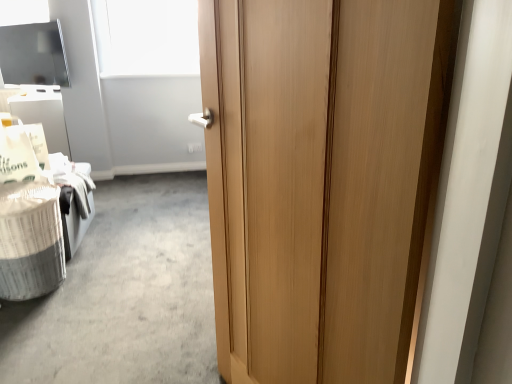
Image resolution: width=512 pixels, height=384 pixels. What do you see at coordinates (321, 179) in the screenshot?
I see `wooden door at center` at bounding box center [321, 179].

Image resolution: width=512 pixels, height=384 pixels. In order to click on wooden door at center in this screenshot , I will do `click(321, 179)`.

Measure the distance between white textured laundry basket at lower left and camera.

white textured laundry basket at lower left and camera are 2.03 meters apart from each other.

Where is `white matte window screen at upper center`? white matte window screen at upper center is located at coordinates (146, 37).

Where is `laundry basket below the wooden door at center (from the image's perspective)`? The width and height of the screenshot is (512, 384). laundry basket below the wooden door at center (from the image's perspective) is located at coordinates (30, 241).

Considering the sizes of objects wooden door at center and white textured laundry basket at lower left in the image provided, who is shorter, wooden door at center or white textured laundry basket at lower left?

Standing shorter between the two is white textured laundry basket at lower left.

Considering the positions of point (431, 81) and point (41, 220), is point (431, 81) closer or farther from the camera than point (41, 220)?

Point (431, 81) is positioned closer to the camera compared to point (41, 220).

Do you think wooden door at center is within white textured laundry basket at lower left, or outside of it?

wooden door at center exists outside the volume of white textured laundry basket at lower left.

Considering the sizes of wooden door at center and white matte window screen at upper center in the image, is wooden door at center taller or shorter than white matte window screen at upper center?

wooden door at center is taller than white matte window screen at upper center.

Looking at this image, considering their positions, is wooden door at center located in front of or behind white matte window screen at upper center?

wooden door at center is positioned closer to the viewer than white matte window screen at upper center.

Considering the sizes of objects wooden door at center and white matte window screen at upper center in the image provided, who is thinner, wooden door at center or white matte window screen at upper center?

wooden door at center.

Considering the points (319, 361) and (151, 69), which point is in front, point (319, 361) or point (151, 69)?

The point (319, 361) is more forward.

How different are the orientations of white textured laundry basket at lower left and white matte window screen at upper center in degrees?

The angular difference between white textured laundry basket at lower left and white matte window screen at upper center is 89.7 degrees.

Considering the positions of point (1, 199) and point (197, 27), is point (1, 199) closer or farther from the camera than point (197, 27)?

Point (1, 199) is farther from the camera than point (197, 27).

Do you think white textured laundry basket at lower left is within white matte window screen at upper center, or outside of it?

white textured laundry basket at lower left is located beyond the bounds of white matte window screen at upper center.

Considering the sizes of white textured laundry basket at lower left and wooden door at center in the image, is white textured laundry basket at lower left wider or thinner than wooden door at center?

Clearly, white textured laundry basket at lower left has more width compared to wooden door at center.

From a real-world perspective, is white textured laundry basket at lower left on wooden door at center?

No, from a real-world perspective, white textured laundry basket at lower left is not above wooden door at center.

Is white textured laundry basket at lower left positioned with its back to wooden door at center?

white textured laundry basket at lower left is not turned away from wooden door at center.

Looking at the image, does white matte window screen at upper center seem bigger or smaller compared to wooden door at center?

Considering their sizes, white matte window screen at upper center takes up less space than wooden door at center.

Could you tell me if white matte window screen at upper center is facing wooden door at center?

Yes, white matte window screen at upper center is oriented towards wooden door at center.

Who is taller, white matte window screen at upper center or wooden door at center?

wooden door at center.

I want to click on laundry basket in front of the white matte window screen at upper center, so click(30, 241).

Is white matte window screen at upper center oriented towards white textured laundry basket at lower left?

Yes, white matte window screen at upper center is oriented towards white textured laundry basket at lower left.

Looking at their sizes, would you say white matte window screen at upper center is wider or thinner than white textured laundry basket at lower left?

In the image, white matte window screen at upper center appears to be more narrow than white textured laundry basket at lower left.

Does white matte window screen at upper center have a lesser height compared to white textured laundry basket at lower left?

Incorrect, the height of white matte window screen at upper center does not fall short of that of white textured laundry basket at lower left.

This screenshot has width=512, height=384. I want to click on door on the right of white textured laundry basket at lower left, so click(321, 179).

At what (x,y) coordinates should I click in order to perform the action: click on door located below the white matte window screen at upper center (from the image's perspective). Please return your answer as a coordinate pair (x, y). The image size is (512, 384). Looking at the image, I should click on (321, 179).

From the image, which object appears to be nearer to white textured laundry basket at lower left, white matte window screen at upper center or wooden door at center?

wooden door at center lies closer to white textured laundry basket at lower left than the other object.

From the image, which object appears to be nearer to wooden door at center, white textured laundry basket at lower left or white matte window screen at upper center?

white textured laundry basket at lower left is positioned closer to the anchor wooden door at center.

Which object lies nearer to the anchor point wooden door at center, white matte window screen at upper center or white textured laundry basket at lower left?

white textured laundry basket at lower left.

Estimate the real-world distances between objects in this image. Which object is closer to white textured laundry basket at lower left, wooden door at center or white matte window screen at upper center?

wooden door at center is closer to white textured laundry basket at lower left.

Which object lies further to the anchor point white matte window screen at upper center, white textured laundry basket at lower left or wooden door at center?

The object further to white matte window screen at upper center is wooden door at center.

Looking at this image, which object lies nearer to the anchor point white matte window screen at upper center, wooden door at center or white textured laundry basket at lower left?

white textured laundry basket at lower left is positioned closer to the anchor white matte window screen at upper center.

Locate an element on the screen. This screenshot has height=384, width=512. laundry basket between wooden door at center and white matte window screen at upper center from front to back is located at coordinates point(30,241).